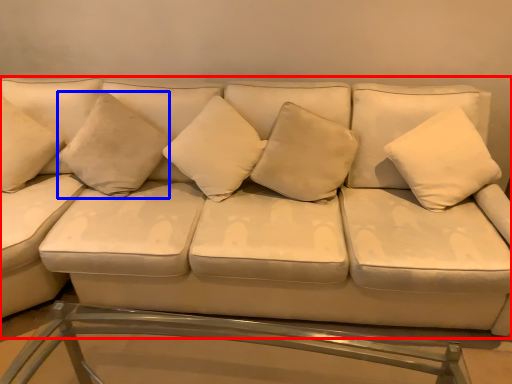
Question: Among these objects, which one is nearest to the camera, studio couch (highlighted by a red box) or pillow (highlighted by a blue box)?

Choices:
 (A) studio couch
 (B) pillow

Answer: (A)